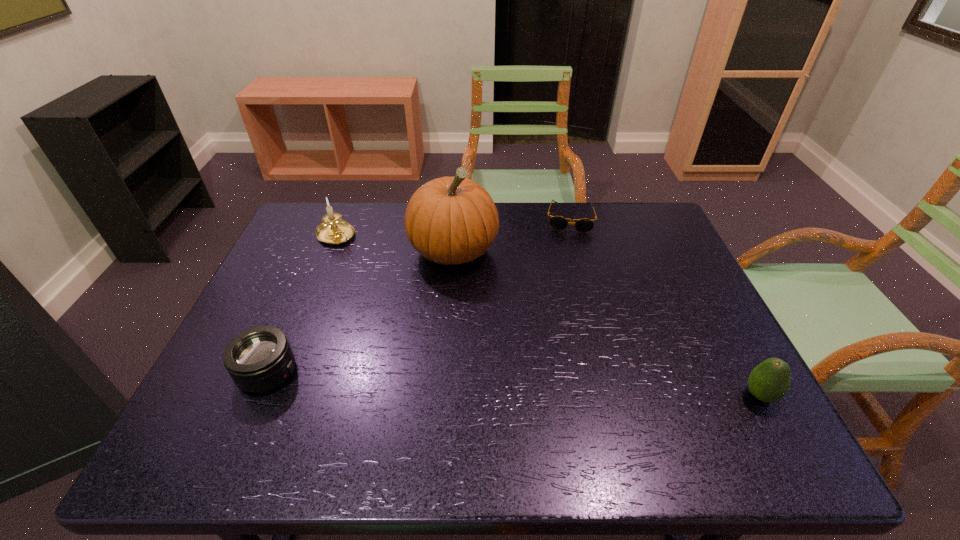
Image resolution: width=960 pixels, height=540 pixels. I want to click on telephoto lens, so click(x=258, y=359).

This screenshot has width=960, height=540. I want to click on the rightmost object, so click(x=770, y=381).

You are a GUI agent. You are given a task and a screenshot of the screen. Output one action in this format:
    pyautogui.click(x=<x>, y=<y>)
    Task: Click on the avocado
    Image resolution: width=960 pixels, height=540 pixels.
    Given the screenshot: What is the action you would take?
    pyautogui.click(x=770, y=381)

The height and width of the screenshot is (540, 960). In order to click on the third object from left to right in this screenshot , I will do `click(451, 220)`.

Identify the location of pumpkin. (451, 220).

Find the location of a particular element. The height and width of the screenshot is (540, 960). sunglasses is located at coordinates (559, 223).

Where is `the shortest object`? The width and height of the screenshot is (960, 540). the shortest object is located at coordinates (559, 223).

Find the location of a particular element. Image resolution: width=960 pixels, height=540 pixels. the fourth shortest object is located at coordinates (333, 230).

This screenshot has width=960, height=540. In order to click on free spot located 0.080m on the side of the telephoto lens with brand markings and control switches in this screenshot , I will do `click(333, 372)`.

Where is `free location located 0.160m on the back of the third shortest object`? Image resolution: width=960 pixels, height=540 pixels. free location located 0.160m on the back of the third shortest object is located at coordinates (723, 327).